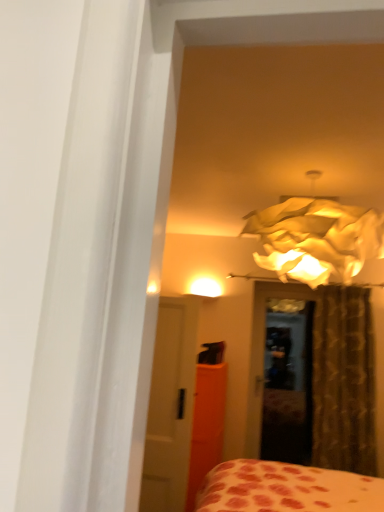
Locate an element on the screen. This screenshot has width=384, height=512. free space above matte paper lampshade at upper center (from a real-world perspective) is located at coordinates (329, 162).